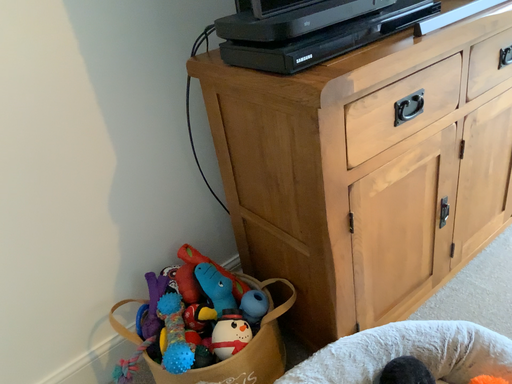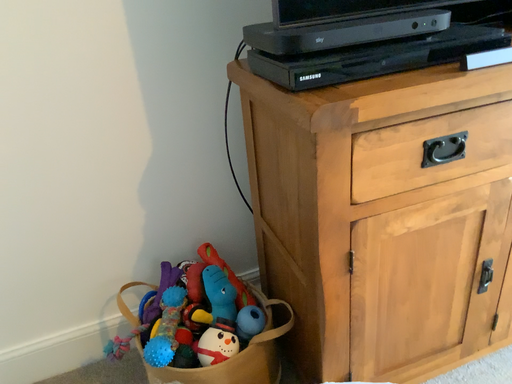
Question: Which way did the camera rotate in the video?

Choices:
 (A) rotated right
 (B) rotated left

Answer: (B)